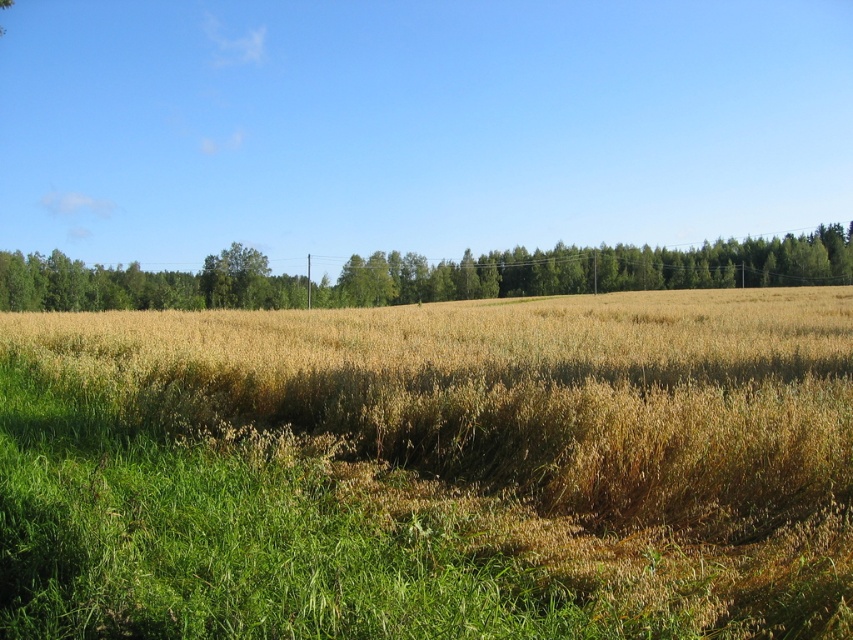
Question: Which object appears farthest from the camera in this image?

Choices:
 (A) green leafy trees at center
 (B) brown grassy wheat field at center

Answer: (A)

Question: Does brown grassy wheat field at center appear over green leafy trees at center?

Choices:
 (A) no
 (B) yes

Answer: (A)

Question: Does brown grassy wheat field at center lie in front of green leafy trees at center?

Choices:
 (A) yes
 (B) no

Answer: (A)

Question: Which point is closer to the camera taking this photo?

Choices:
 (A) tap(241, 448)
 (B) tap(688, 275)

Answer: (A)

Question: Among these objects, which one is nearest to the camera?

Choices:
 (A) green leafy trees at center
 (B) brown grassy wheat field at center

Answer: (B)

Question: Can you confirm if brown grassy wheat field at center is smaller than green leafy trees at center?

Choices:
 (A) yes
 (B) no

Answer: (A)